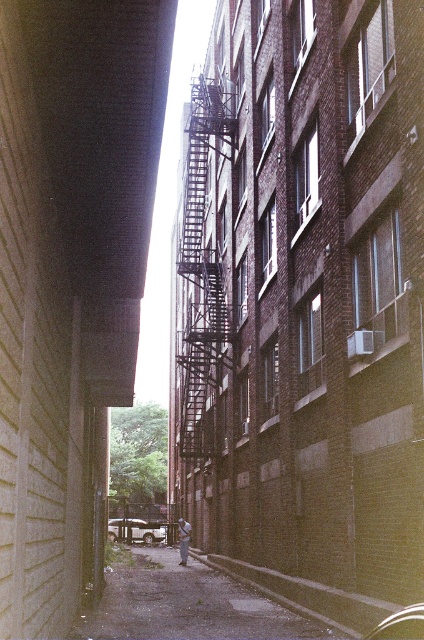
Who is more forward, (217, 580) or (209, 368)?

Positioned in front is point (217, 580).

Does point (206, 624) come behind point (219, 365)?

That is False.

Does point (134, 576) lie behind point (197, 305)?

No.

Locate an element on the screen. The height and width of the screenshot is (640, 424). concrete sidewalk at center is located at coordinates [x=186, y=604].